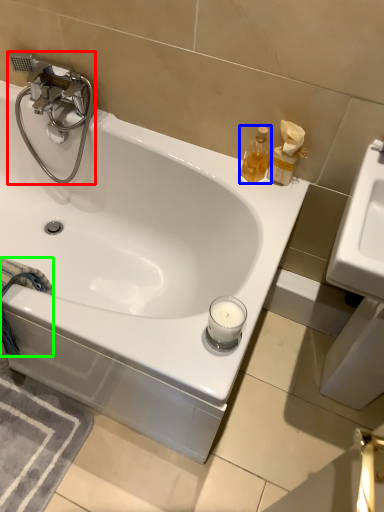
Question: Which object is positioned closest to tap (highlighted by a red box)? Select from soap dispenser (highlighted by a blue box) and bath towel (highlighted by a green box).

Choices:
 (A) soap dispenser
 (B) bath towel

Answer: (B)